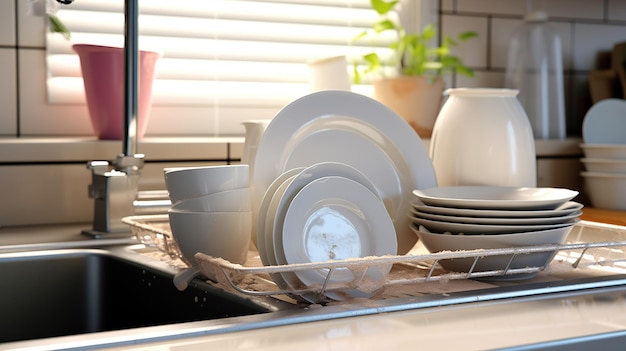
The image size is (626, 351). I want to click on plates, so (x=317, y=203), (x=324, y=172), (x=280, y=190), (x=273, y=181), (x=297, y=144).